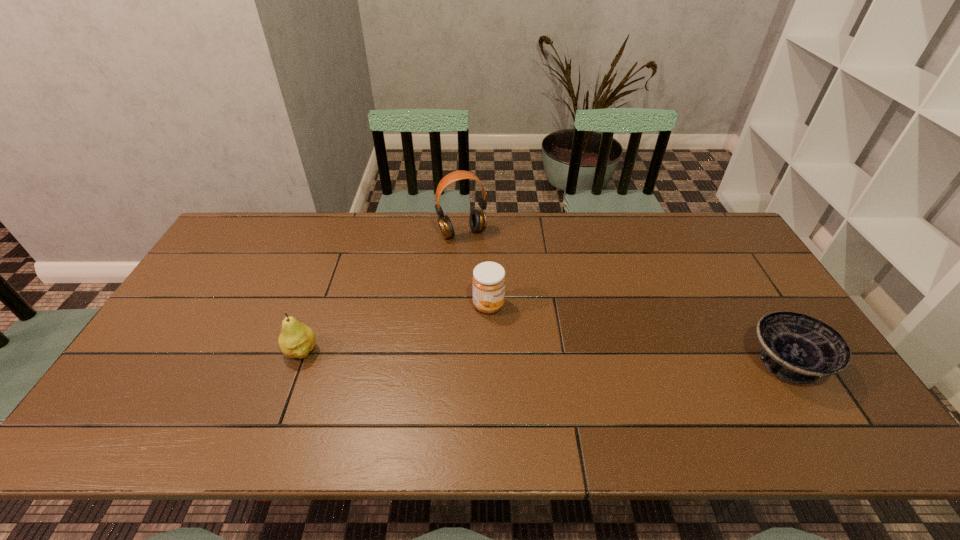
At what (x,y) coordinates should I click in order to perform the action: click on free space on the desktop that is between the pear and the shortest object and is positioned on the front label of the second farthest object. Please return your answer as a coordinate pair (x, y). This screenshot has height=540, width=960. Looking at the image, I should click on (588, 358).

Identify the location of vacant space on the desktop that is between the leftmost object and the rightmost object and is positioned on the ear cups of the headset. (528, 356).